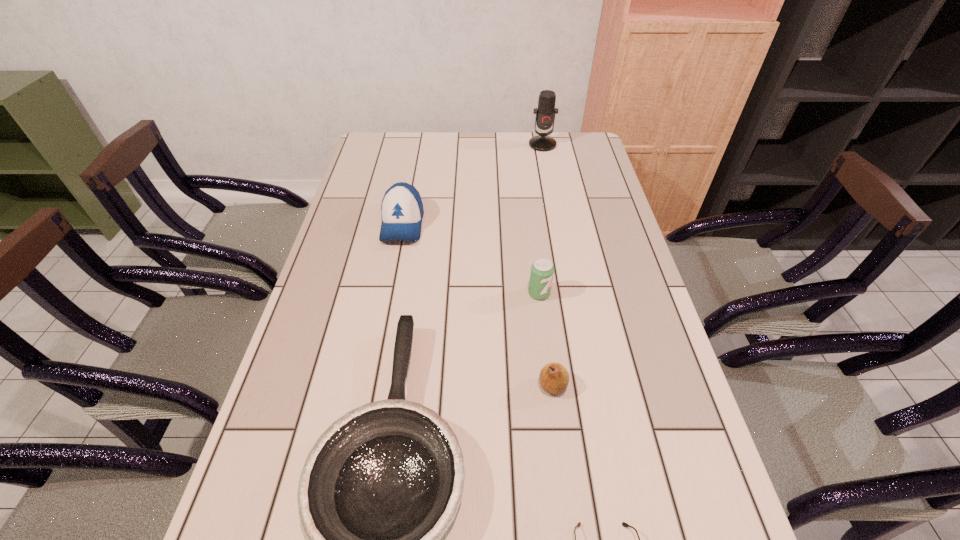
The width and height of the screenshot is (960, 540). Identify the location of empty space between the third shortest object and the soda. (546, 340).

At what (x,y) coordinates should I click in order to perform the action: click on object that is the second closest one to the pear. Please return your answer as a coordinate pair (x, y). Looking at the image, I should click on (542, 270).

Where is `the second closest object to the third farthest object`? Image resolution: width=960 pixels, height=540 pixels. the second closest object to the third farthest object is located at coordinates (554, 378).